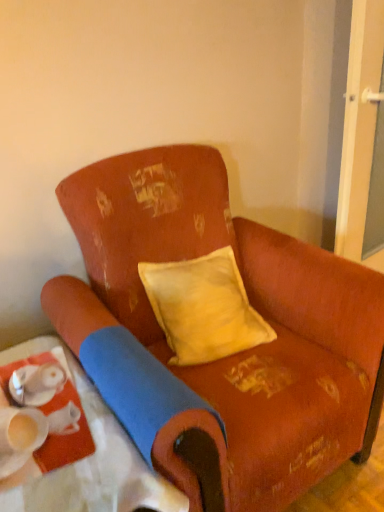
Question: Considering the positions of yellow velvet pillow at center and matte white tray at lower left in the image, is yellow velvet pillow at center taller or shorter than matte white tray at lower left?

Choices:
 (A) short
 (B) tall

Answer: (A)

Question: Is yellow velvet pillow at center wider or thinner than matte white tray at lower left?

Choices:
 (A) wide
 (B) thin

Answer: (B)

Question: Estimate the real-world distances between objects in this image. Which object is closer to the worn fabric chair at center?

Choices:
 (A) yellow velvet pillow at center
 (B) transparent glass screen door at right
 (C) matte white tray at lower left

Answer: (A)

Question: Which of these objects is positioned farthest from the matte white tray at lower left?

Choices:
 (A) worn fabric chair at center
 (B) yellow velvet pillow at center
 (C) transparent glass screen door at right

Answer: (C)